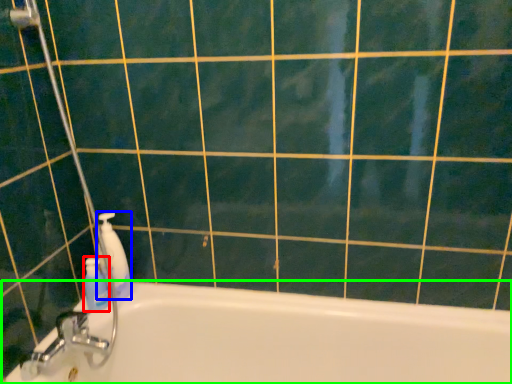
Question: Estimate the real-world distances between objects in this image. Which object is closer to cleaning product (highlighted by a red box), cleaning product (highlighted by a blue box) or bathtub (highlighted by a green box)?

Choices:
 (A) cleaning product
 (B) bathtub

Answer: (A)